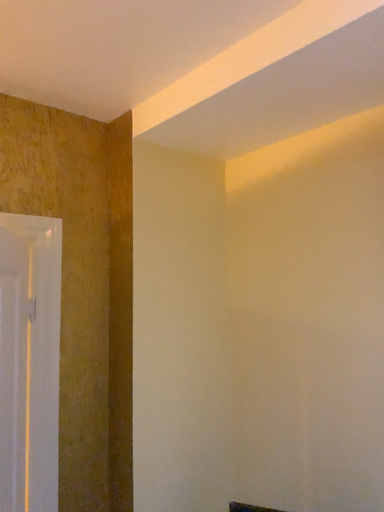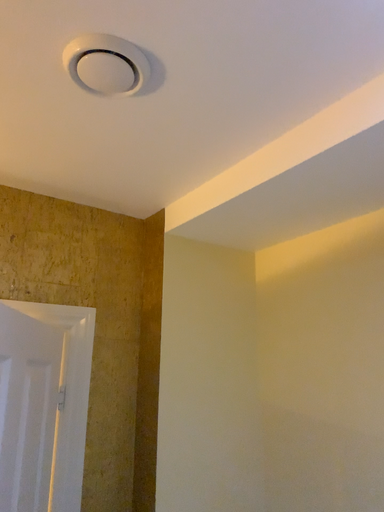
Question: How did the camera likely rotate when shooting the video?

Choices:
 (A) rotated upward
 (B) rotated downward

Answer: (A)